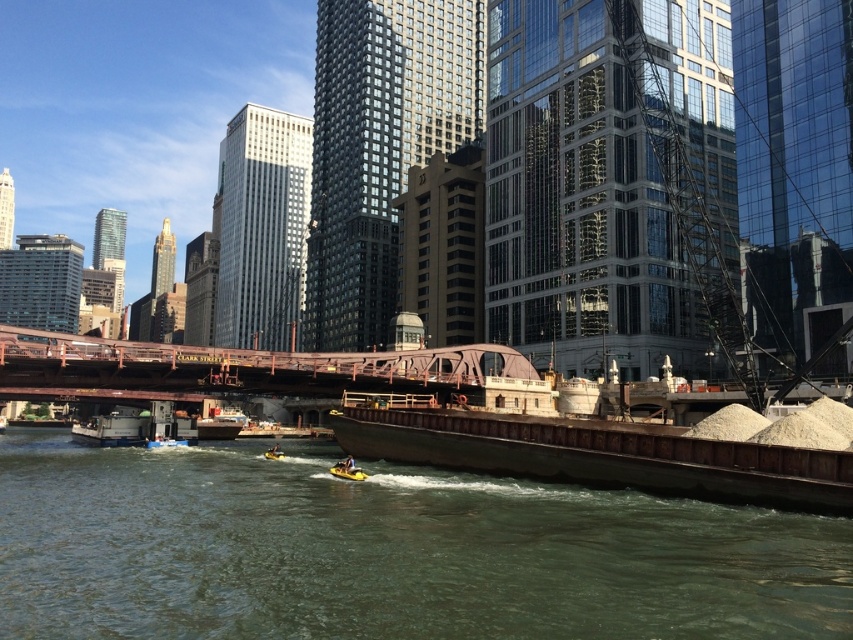
You are a boat operator who needs to navigate between the greenish water at lower center and the brown metallic barge at lower center. Based on the scene description, which one is wider?

The greenish water at lower center is wider than the brown metallic barge at lower center according to the description.

You are standing at the point of origin in the image. The rustic metal bridge at center is located at coordinates 0.577 on the x axis and 0.281 on the y axis. If you want to reach the bridge from your current position, which direction should you move in terms of x and y coordinates?

The rustic metal bridge at center is located at coordinates x 0.577 and y 0.281. To reach it from the origin, you should move towards increasing x and decreasing y coordinates since the bridge is at a higher x and lower y position compared to the origin.

You are a delivery drone flying at an altitude of 30 feet. You need to deliver a package to a location near the metallic gray barge at lower left. However, you must avoid flying over the rustic metal bridge at center. Can you safely navigate between them without crossing the bridge?

The distance between the rustic metal bridge at center and the metallic gray barge at lower left is 44.22 feet. Since the drone is flying at 30 feet altitude, it can safely navigate between them horizontally without crossing the bridge.